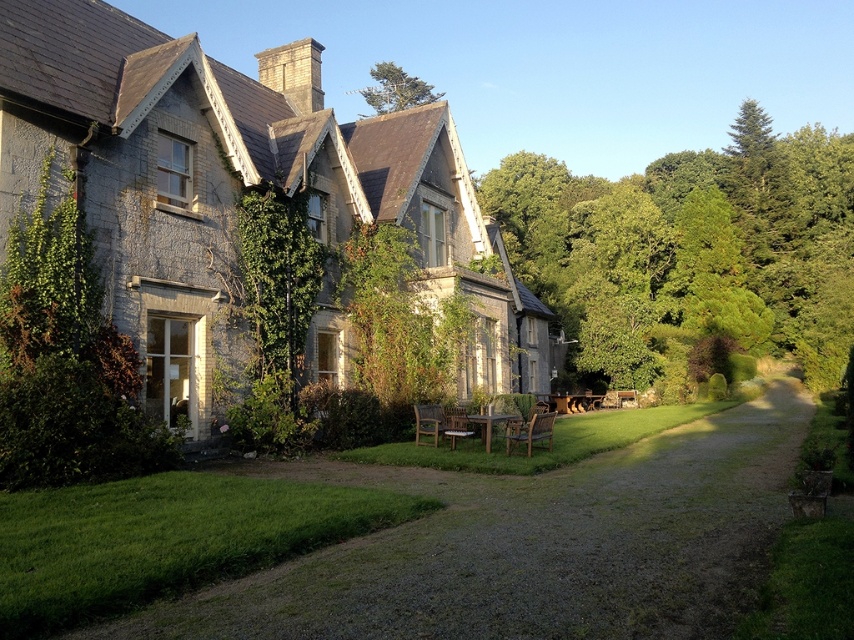
Does point (232, 172) come closer to viewer compared to point (736, 333)?

Yes, point (232, 172) is closer to viewer.

Is stone cottage at center closer to the viewer compared to green leafy tree at right?

Yes, stone cottage at center is closer to the viewer.

Identify the location of stone cottage at center. (237, 188).

Which of these two, gravel at center or green leafy tree at upper center, stands shorter?

With less height is gravel at center.

Locate an element on the screen. This screenshot has height=640, width=854. gravel at center is located at coordinates (530, 545).

Does gravel at center have a larger size compared to green leafy tree at right?

Incorrect, gravel at center is not larger than green leafy tree at right.

Is gravel at center further to the viewer compared to green leafy tree at right?

No, gravel at center is closer to the viewer.

In order to click on gravel at center in this screenshot , I will do `click(530, 545)`.

This screenshot has width=854, height=640. I want to click on gravel at center, so click(x=530, y=545).